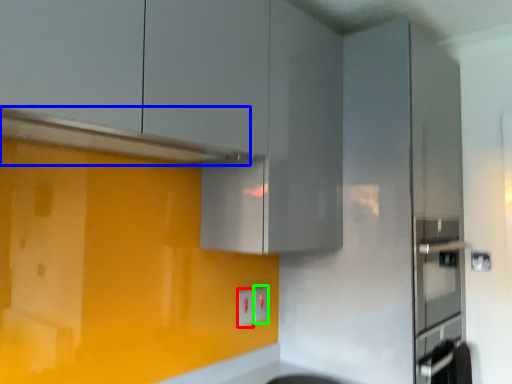
Question: Which object is the farthest from electric outlet (highlighted by a red box)? Choose among these: exhaust hood (highlighted by a blue box) or electric outlet (highlighted by a green box).

Choices:
 (A) exhaust hood
 (B) electric outlet

Answer: (A)